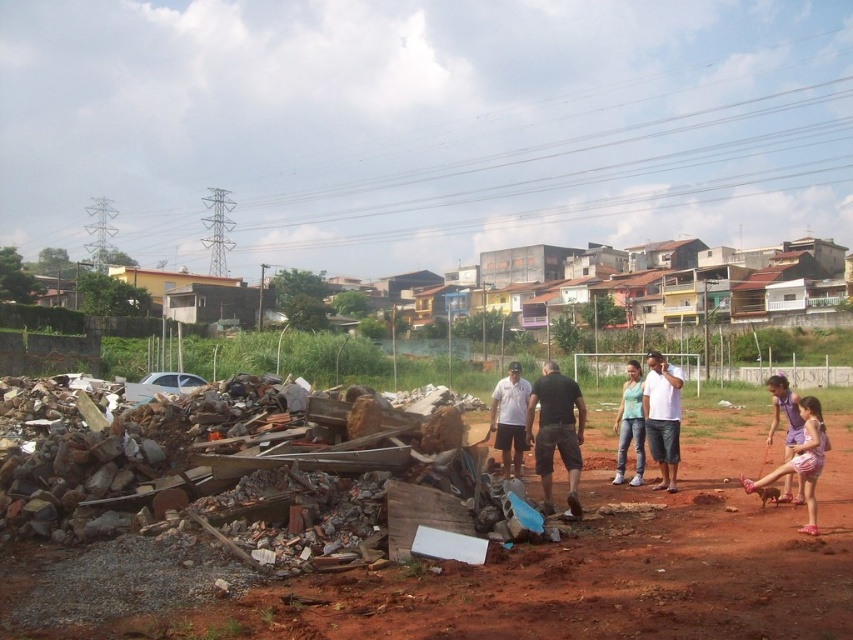
This screenshot has width=853, height=640. I want to click on white cotton shirt at center, so click(662, 417).

The height and width of the screenshot is (640, 853). In order to click on white cotton shirt at center in this screenshot , I will do `click(662, 417)`.

Identify the location of white cotton shirt at center. (662, 417).

Which of these two, black cotton shirt at center or pink fabric shorts at lower right, stands shorter?

pink fabric shorts at lower right is shorter.

Is the position of black cotton shirt at center less distant than that of pink fabric shorts at lower right?

No, black cotton shirt at center is behind pink fabric shorts at lower right.

Describe the element at coordinates (556, 433) in the screenshot. I see `black cotton shirt at center` at that location.

I want to click on black cotton shirt at center, so click(556, 433).

Does black cotton shirt at center have a greater height compared to white cotton shirt at center?

No.

Is point (561, 401) positioned behind point (671, 492)?

That is False.

The image size is (853, 640). I want to click on black cotton shirt at center, so click(x=556, y=433).